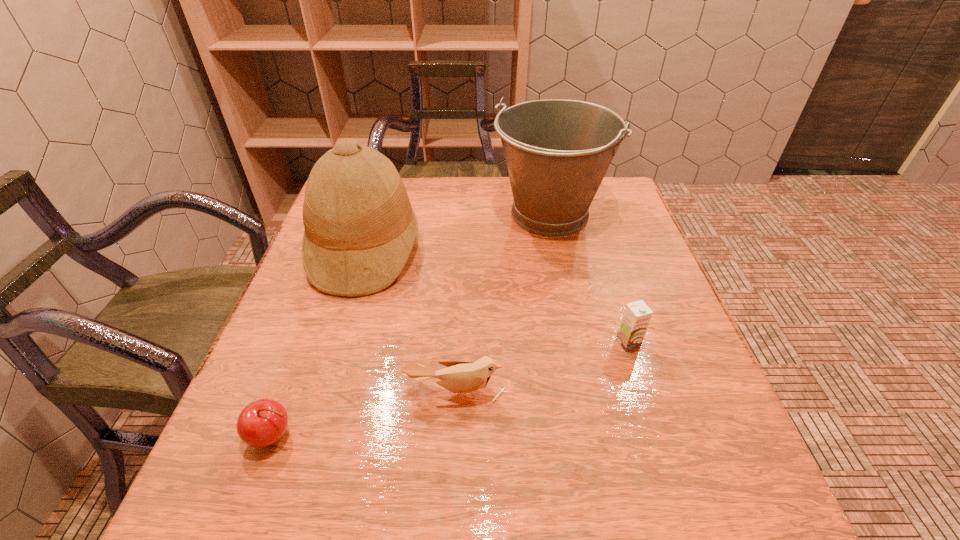
The height and width of the screenshot is (540, 960). What are the coordinates of `bucket` in the screenshot? It's located at (557, 152).

The image size is (960, 540). Identify the location of hat. (359, 227).

The image size is (960, 540). I want to click on the third nearest object, so click(637, 315).

Find the location of `bird`. bird is located at coordinates (460, 376).

Locate an element on the screen. This screenshot has width=960, height=540. the nearest object is located at coordinates (263, 422).

Image resolution: width=960 pixels, height=540 pixels. I want to click on vacant space located 0.130m on the left of the bucket, so click(444, 214).

The width and height of the screenshot is (960, 540). I want to click on vacant space located on the front-facing side of the hat, so click(514, 249).

This screenshot has height=540, width=960. In order to click on vacant region located 0.380m on the back of the third nearest object in this screenshot , I will do `click(590, 224)`.

You are a GUI agent. You are given a task and a screenshot of the screen. Output one action in this format:
    pyautogui.click(x=<x>, y=<y>)
    Task: Click on the vacant space located 0.110m at the beak of the fourth farthest object
    This screenshot has width=960, height=540.
    Given the screenshot: What is the action you would take?
    pyautogui.click(x=453, y=470)

At what (x,y) coordinates should I click in order to perform the action: click on free point located 0.220m on the right of the nearest object. Please return your answer as a coordinate pair (x, y). Looking at the image, I should click on (437, 436).